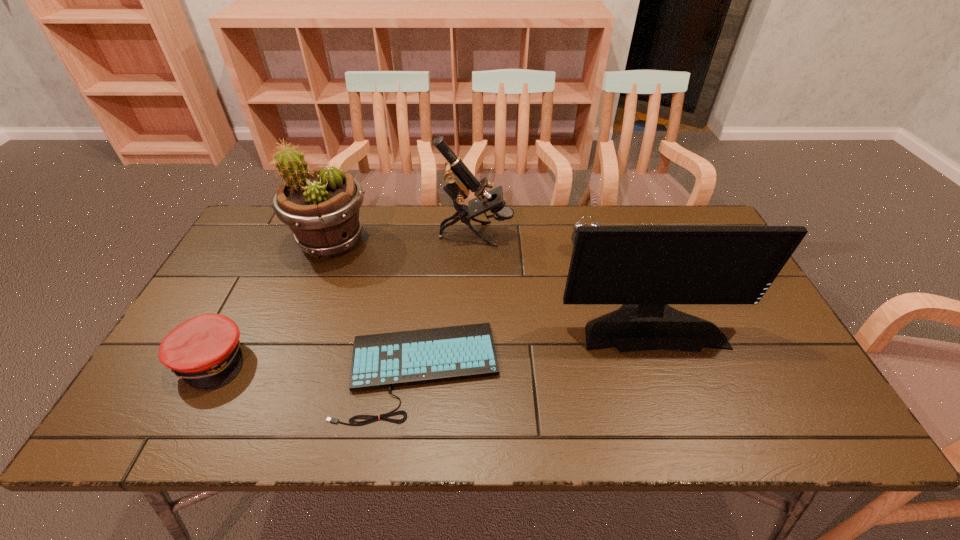
This screenshot has width=960, height=540. In order to click on free spot between the third shortest object and the second shortest object in this screenshot , I will do `click(397, 305)`.

At what (x,y) coordinates should I click in order to perform the action: click on vacant space in between the microscope and the shortest object. Please return your answer as a coordinate pair (x, y). Looking at the image, I should click on 448,302.

Where is `free space between the computer keyboard and the microscope`? free space between the computer keyboard and the microscope is located at coordinates (448, 302).

Choose which object is the third nearest neighbor to the monitor. Please provide its 2D coordinates. Your answer should be formatted as a tuple, i.e. [(x, y)], where the tuple contains the x and y coordinates of a point satisfying the conditions above.

[(459, 179)]

Locate which object is the second closest to the flowerpot. Please provide its 2D coordinates. Your answer should be formatted as a tuple, i.e. [(x, y)], where the tuple contains the x and y coordinates of a point satisfying the conditions above.

[(459, 179)]

Where is `free space that satisfies the following two spatial constraints: 1. at the front of the computer keyboard where the visor is located; 2. on the right side of the cap`? The height and width of the screenshot is (540, 960). free space that satisfies the following two spatial constraints: 1. at the front of the computer keyboard where the visor is located; 2. on the right side of the cap is located at coordinates (205, 369).

Identify the location of vacant space that satisfies the following two spatial constraints: 1. on the back side of the shortest object; 2. at the front of the cap where the visor is located. Image resolution: width=960 pixels, height=540 pixels. (420, 360).